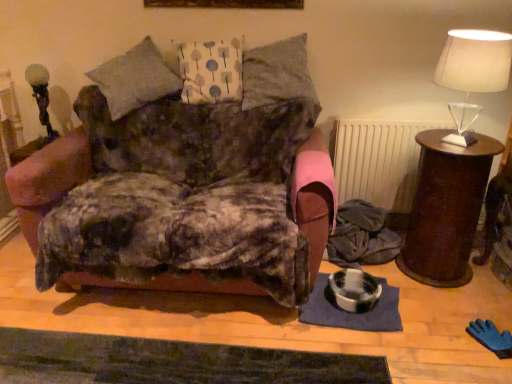
Question: Is white fabric pillow at center, marked as the first pillow in a left-to-right arrangement, wider than brown wooden side table at right?

Choices:
 (A) no
 (B) yes

Answer: (A)

Question: Does white fabric pillow at center, marked as the first pillow in a left-to-right arrangement, have a larger size compared to brown wooden side table at right?

Choices:
 (A) no
 (B) yes

Answer: (A)

Question: Is brown wooden side table at right inside white fabric pillow at center, arranged as the second pillow when viewed from the right?

Choices:
 (A) no
 (B) yes

Answer: (A)

Question: Could you tell me if white fabric pillow at center, arranged as the second pillow when viewed from the right, is turned towards brown wooden side table at right?

Choices:
 (A) no
 (B) yes

Answer: (A)

Question: From a real-world perspective, is white fabric pillow at center, arranged as the second pillow when viewed from the right, located beneath brown wooden side table at right?

Choices:
 (A) no
 (B) yes

Answer: (A)

Question: From the image's perspective, would you say white fabric pillow at center, marked as the first pillow in a left-to-right arrangement, is positioned over brown wooden side table at right?

Choices:
 (A) no
 (B) yes

Answer: (B)

Question: Is brown wooden side table at right directly adjacent to white textured radiator at center?

Choices:
 (A) no
 (B) yes

Answer: (A)

Question: Is brown wooden side table at right closer to camera compared to white textured radiator at center?

Choices:
 (A) no
 (B) yes

Answer: (B)

Question: Considering the relative sizes of brown wooden side table at right and white textured radiator at center in the image provided, is brown wooden side table at right bigger than white textured radiator at center?

Choices:
 (A) yes
 (B) no

Answer: (A)

Question: Does brown wooden side table at right have a smaller size compared to white textured radiator at center?

Choices:
 (A) no
 (B) yes

Answer: (A)

Question: From the image's perspective, is brown wooden side table at right on white textured radiator at center?

Choices:
 (A) no
 (B) yes

Answer: (A)

Question: Is brown wooden side table at right wider than white textured radiator at center?

Choices:
 (A) yes
 (B) no

Answer: (A)

Question: Is the position of translucent glass table lamp at upper right, which is the first table lamp in right-to-left order, less distant than that of white textured radiator at center?

Choices:
 (A) yes
 (B) no

Answer: (A)